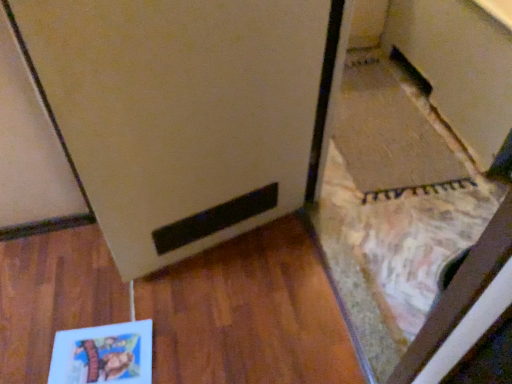
At what (x,y) coordinates should I click in order to perform the action: click on free space in front of matte white fridge at center. Please return your answer as a coordinate pair (x, y). Looking at the image, I should click on (238, 331).